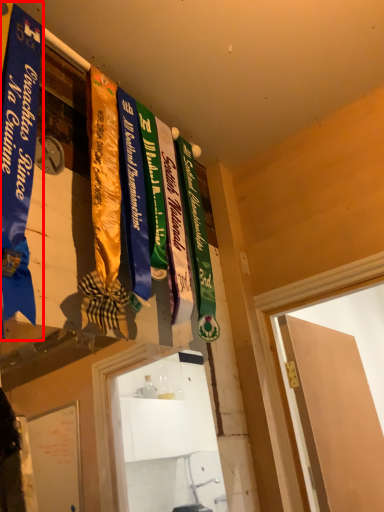
Question: From the image's perspective, where is banner (annotated by the red box) located in relation to door in the image?

Choices:
 (A) above
 (B) below

Answer: (A)